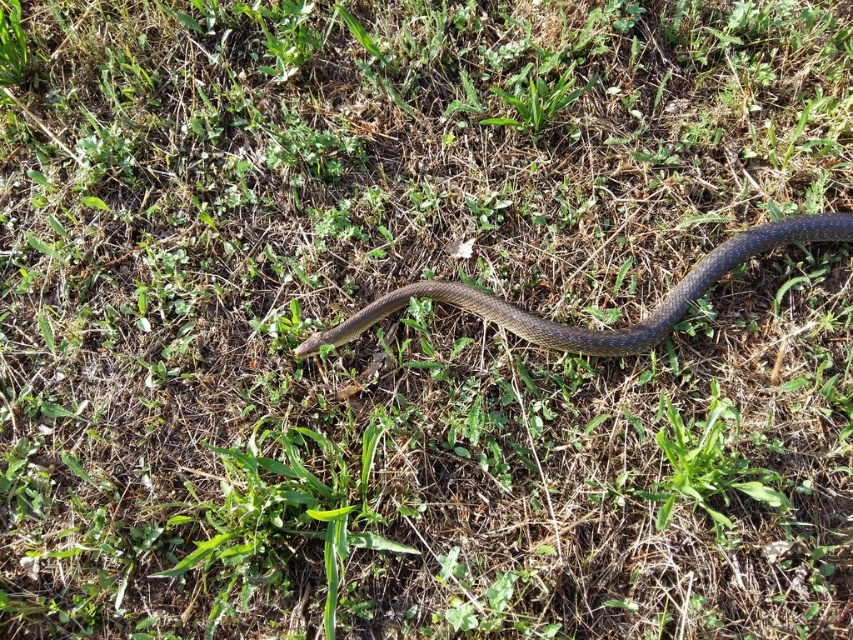
You are a gardener who needs to remove the green leafy weed at upper center without getting too close to the shiny black snake at center. What is the minimum distance you should maintain between yourself and the snake to safely reach the weed?

The shiny black snake at center is 21.65 inches away from the green leafy weed at upper center. To safely reach the weed without getting too close to the snake, you should maintain a minimum distance of at least 21.65 inches from the shiny black snake at center.

You are a hiker who spots the shiny black snake at center and the green leafy weed at upper center in the grass. Which object is larger in size?

The shiny black snake at center is bigger than the green leafy weed at upper center, so the snake is larger in size.

You are a hiker who has spotted a shiny black snake at center. You want to take a photo of it without getting too close. You have a camera with a zoom lens that can focus on objects at a distance of up to 10 meters. The snake is located at point (592,330) in the image coordinates. Can you determine if the snake is within the camera lens range based on the coordinates?

The coordinates of the shiny black snake at center are point (592,330), but without knowing the actual distance corresponding to these coordinates, it is impossible to determine if it is within the camera lens range of 10 meters.